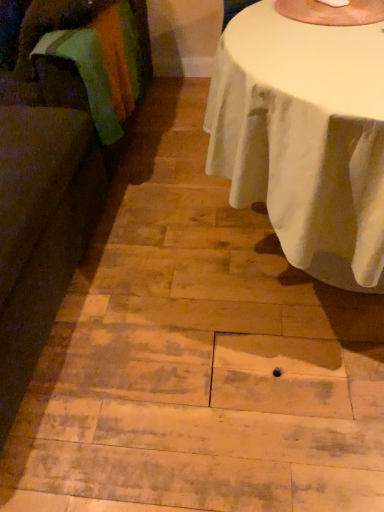
Identify the location of brown leather swivel chair at left. (42, 210).

This screenshot has height=512, width=384. What do you see at coordinates (42, 210) in the screenshot?
I see `brown leather swivel chair at left` at bounding box center [42, 210].

In order to face brown leather swivel chair at left, should I rotate leftwards or rightwards?

Turn left approximately 27.286 degrees to face it.

The height and width of the screenshot is (512, 384). Find the location of `brown leather swivel chair at left`. brown leather swivel chair at left is located at coordinates (42, 210).